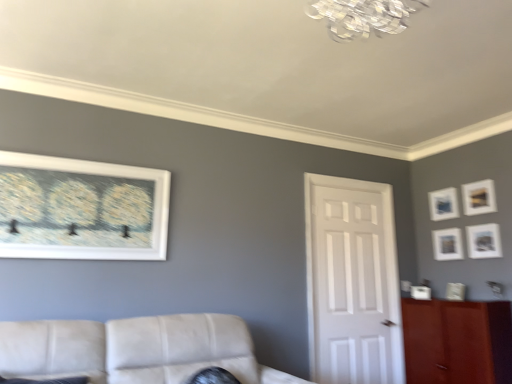
Measure the distance between point (498, 359) and camera.

They are 9.49 feet apart.

Identify the location of brown wood cabinet at right. The image size is (512, 384). (457, 342).

This screenshot has height=384, width=512. What do you see at coordinates (352, 282) in the screenshot? I see `white glossy door at center` at bounding box center [352, 282].

This screenshot has width=512, height=384. Describe the element at coordinates (443, 204) in the screenshot. I see `matte blue picture frame at upper right, the 1th picture frame viewed from the back` at that location.

In order to click on matte blue picture frame at upper right, the third picture frame viewed from the right in this screenshot , I will do `click(443, 204)`.

What do you see at coordinates (484, 241) in the screenshot?
I see `matte white picture frame at right, placed as the 1th picture frame when sorted from right to left` at bounding box center [484, 241].

Identify the location of matte gold picture frame at upper right, which is the 5th picture frame in left-to-right order. This screenshot has width=512, height=384. (479, 197).

How many degrees apart are the facing directions of brown wood cabinet at right and white glossy door at center?

The angle between the facing direction of brown wood cabinet at right and the facing direction of white glossy door at center is 89.6 degrees.

From the picture: Considering the relative sizes of brown wood cabinet at right and white glossy door at center in the image provided, is brown wood cabinet at right wider than white glossy door at center?

Yes.

Between point (458, 379) and point (377, 343), which one is positioned behind?

Point (377, 343)

Locate an element on the screen. Image resolution: width=512 pixels, height=384 pixels. door behind the brown wood cabinet at right is located at coordinates (352, 282).

Where is `cabinetry below the matte white picture frame at upper right, placed as the third picture frame when sorted from left to right (from the image's perspective)`? cabinetry below the matte white picture frame at upper right, placed as the third picture frame when sorted from left to right (from the image's perspective) is located at coordinates (457, 342).

Is matte white picture frame at upper right, marked as the 2th picture frame in a back-to-front arrangement, wider than brown wood cabinet at right?

In fact, matte white picture frame at upper right, marked as the 2th picture frame in a back-to-front arrangement, might be narrower than brown wood cabinet at right.

Is matte white picture frame at upper right, positioned as the 5th picture frame in front-to-back order, facing towards brown wood cabinet at right?

No, matte white picture frame at upper right, positioned as the 5th picture frame in front-to-back order, is not turned towards brown wood cabinet at right.

From the picture: Does matte white picture frame at upper right, positioned as the 5th picture frame in front-to-back order, touch white glossy door at center?

They are not placed beside each other.

Is matte white picture frame at upper right, placed as the third picture frame when sorted from left to right, taller than white glossy door at center?

No.

From the image's perspective, which is above, matte white picture frame at upper right, placed as the third picture frame when sorted from left to right, or white glossy door at center?

From the image's view, matte white picture frame at upper right, placed as the third picture frame when sorted from left to right, is above.

Find the location of a particular element. the 4th picture frame behind the white glossy door at center is located at coordinates (447, 244).

Identify the location of picture frame that is the 3rd object located in front of the matte blue picture frame at upper right, the sixth picture frame viewed from the front. The image size is (512, 384). (479, 197).

From the image's perspective, would you say matte gold picture frame at upper right, which ranks as the third picture frame in front-to-back order, is positioned over matte blue picture frame at upper right, acting as the 4th picture frame starting from the left?

Correct, matte gold picture frame at upper right, which ranks as the third picture frame in front-to-back order, appears higher than matte blue picture frame at upper right, acting as the 4th picture frame starting from the left, in the image.

Is matte gold picture frame at upper right, positioned as the 2th picture frame in right-to-left order, positioned before matte blue picture frame at upper right, the 1th picture frame viewed from the back?

Yes, matte gold picture frame at upper right, positioned as the 2th picture frame in right-to-left order, is in front of matte blue picture frame at upper right, the 1th picture frame viewed from the back.

Considering the sizes of leather couch at lower left and matte gold picture frame at upper right, which ranks as the third picture frame in front-to-back order, in the image, is leather couch at lower left wider or thinner than matte gold picture frame at upper right, which ranks as the third picture frame in front-to-back order,?

In the image, leather couch at lower left appears to be wider than matte gold picture frame at upper right, which ranks as the third picture frame in front-to-back order.

What's the angular difference between leather couch at lower left and matte gold picture frame at upper right, placed as the 4th picture frame when sorted from back to front,'s facing directions?

They differ by 90.7 degrees in their facing directions.

Considering the relative sizes of leather couch at lower left and matte gold picture frame at upper right, positioned as the 2th picture frame in right-to-left order, in the image provided, is leather couch at lower left bigger than matte gold picture frame at upper right, positioned as the 2th picture frame in right-to-left order,?

Yes.

From a real-world perspective, which object stands above the other?

From a 3D spatial view, matte gold picture frame at upper right, positioned as the 2th picture frame in right-to-left order, is above.

From the image's perspective, is matte white picture frame at upper right, marked as the 2th picture frame in a back-to-front arrangement, positioned above or below leather couch at lower left?

Based on their image positions, matte white picture frame at upper right, marked as the 2th picture frame in a back-to-front arrangement, is located above leather couch at lower left.

In the scene shown: Which of these two, matte white picture frame at upper right, marked as the 2th picture frame in a back-to-front arrangement, or leather couch at lower left, is bigger?

Bigger between the two is leather couch at lower left.

Is point (451, 251) closer or farther from the camera than point (209, 326)?

Point (451, 251).

Where is `door below the matte white picture frame at right, which ranks as the 5th picture frame in back-to-front order (from the image's perspective)`? The width and height of the screenshot is (512, 384). door below the matte white picture frame at right, which ranks as the 5th picture frame in back-to-front order (from the image's perspective) is located at coordinates (352, 282).

From a real-world perspective, is white glossy door at center under matte white picture frame at right, positioned as the sixth picture frame in left-to-right order?

Yes, from a real-world perspective, white glossy door at center is beneath matte white picture frame at right, positioned as the sixth picture frame in left-to-right order.

Is white glossy door at center facing away from matte white picture frame at right, which ranks as the 5th picture frame in back-to-front order?

No, matte white picture frame at right, which ranks as the 5th picture frame in back-to-front order, is not at the back of white glossy door at center.

Between point (367, 350) and point (494, 242), which one is positioned in front?

The point (494, 242) is closer.

Where is `door above the brown wood cabinet at right (from the image's perspective)`? The height and width of the screenshot is (384, 512). door above the brown wood cabinet at right (from the image's perspective) is located at coordinates (352, 282).

Image resolution: width=512 pixels, height=384 pixels. Identify the location of cabinetry located underneath the matte white picture frame at upper right, positioned as the 5th picture frame in front-to-back order (from a real-world perspective). (457, 342).

Based on their spatial positions, is brown wood cabinet at right or white matte picture frame at upper left, arranged as the sixth picture frame when viewed from the right, closer to matte white picture frame at right, which ranks as the 5th picture frame in back-to-front order?

brown wood cabinet at right lies closer to matte white picture frame at right, which ranks as the 5th picture frame in back-to-front order, than the other object.

Estimate the real-world distances between objects in this image. Which object is closer to matte white picture frame at right, the second picture frame viewed from the front, brown wood cabinet at right or white matte picture frame at right, acting as the 4th picture frame starting from the front?

Based on the image, white matte picture frame at right, acting as the 4th picture frame starting from the front, appears to be nearer to matte white picture frame at right, the second picture frame viewed from the front.

When comparing their distances from brown wood cabinet at right, does matte blue picture frame at upper right, the sixth picture frame viewed from the front, or leather couch at lower left seem closer?

matte blue picture frame at upper right, the sixth picture frame viewed from the front, lies closer to brown wood cabinet at right than the other object.

Looking at the image, which one is located closer to brown wood cabinet at right, matte white picture frame at right, the second picture frame viewed from the front, or leather couch at lower left?

The object closer to brown wood cabinet at right is matte white picture frame at right, the second picture frame viewed from the front.

When comparing their distances from matte gold picture frame at upper right, which is the 5th picture frame in left-to-right order, does white glossy door at center or brown wood cabinet at right seem closer?

Among the two, brown wood cabinet at right is located nearer to matte gold picture frame at upper right, which is the 5th picture frame in left-to-right order.

When comparing their distances from matte white picture frame at upper right, placed as the third picture frame when sorted from left to right, does white matte picture frame at right, acting as the 4th picture frame starting from the front, or matte white picture frame at right, positioned as the sixth picture frame in left-to-right order, seem closer?

Based on the image, matte white picture frame at right, positioned as the sixth picture frame in left-to-right order, appears to be nearer to matte white picture frame at upper right, placed as the third picture frame when sorted from left to right.

Based on their spatial positions, is matte white picture frame at right, which ranks as the 5th picture frame in back-to-front order, or matte white picture frame at upper right, placed as the third picture frame when sorted from left to right, further from matte blue picture frame at upper right, the third picture frame viewed from the right?

Based on the image, matte white picture frame at right, which ranks as the 5th picture frame in back-to-front order, appears to be further to matte blue picture frame at upper right, the third picture frame viewed from the right.

Considering their positions, is matte white picture frame at right, which ranks as the 5th picture frame in back-to-front order, positioned closer to leather couch at lower left than matte blue picture frame at upper right, the third picture frame viewed from the right?

matte white picture frame at right, which ranks as the 5th picture frame in back-to-front order, lies closer to leather couch at lower left than the other object.

Image resolution: width=512 pixels, height=384 pixels. I want to click on studio couch between white matte picture frame at upper left, arranged as the sixth picture frame when viewed from the right, and brown wood cabinet at right, in the horizontal direction, so click(x=134, y=349).

Identify the location of cabinetry between white glossy door at center and matte white picture frame at upper right, placed as the third picture frame when sorted from left to right, from left to right. Image resolution: width=512 pixels, height=384 pixels. (457, 342).

Find the location of a particular element. The width and height of the screenshot is (512, 384). door located between leather couch at lower left and matte blue picture frame at upper right, acting as the 4th picture frame starting from the left, in the depth direction is located at coordinates (352, 282).

Identify the location of door between matte gold picture frame at upper right, which is the 5th picture frame in left-to-right order, and brown wood cabinet at right from top to bottom. This screenshot has height=384, width=512. click(x=352, y=282).